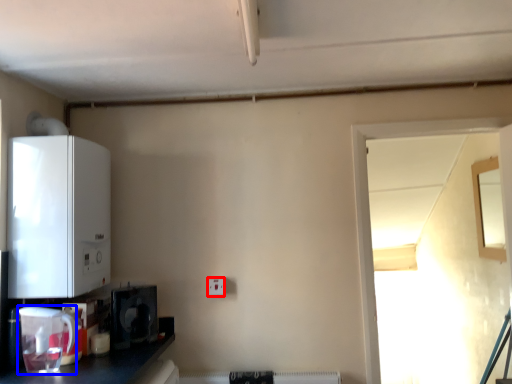
Question: Which point is further to the camera, electric outlet (highlighted by a red box) or appliance (highlighted by a blue box)?

Choices:
 (A) electric outlet
 (B) appliance

Answer: (A)